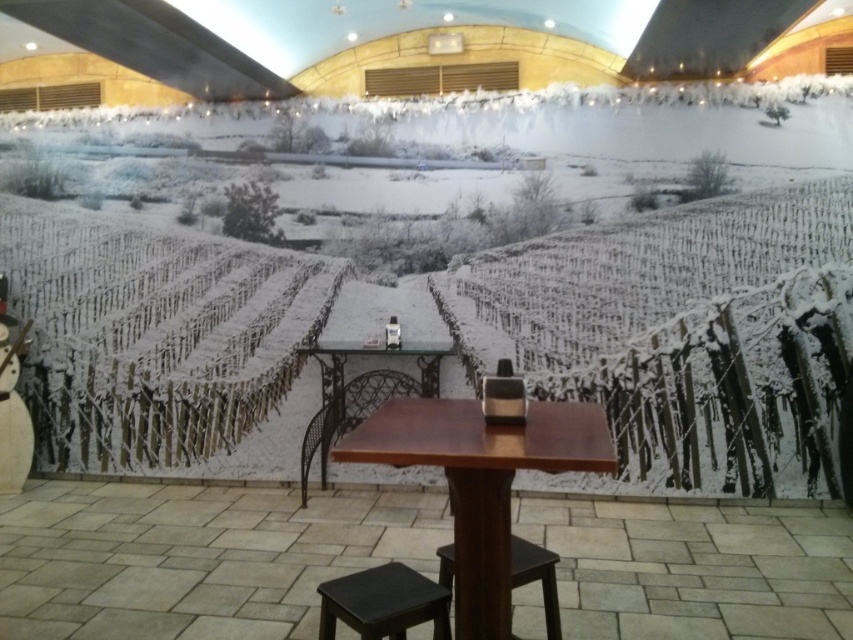
Which is behind, point (329, 611) or point (337, 433)?

The point (337, 433) is behind.

Does dark brown wooden stool at lower center appear under metallic brown chair at center?

Yes.

Where is `dark brown wooden stool at lower center`? This screenshot has width=853, height=640. dark brown wooden stool at lower center is located at coordinates (383, 602).

Where is `dark brown wooden stool at lower center`? Image resolution: width=853 pixels, height=640 pixels. dark brown wooden stool at lower center is located at coordinates [x=383, y=602].

Can you confirm if wooden table at center is wider than dark brown wooden stool at lower center?

Yes, wooden table at center is wider than dark brown wooden stool at lower center.

Does wooden table at center have a smaller size compared to dark brown wooden stool at lower center?

Actually, wooden table at center might be larger than dark brown wooden stool at lower center.

Locate an element on the screen. This screenshot has height=640, width=853. wooden table at center is located at coordinates (480, 481).

Can you confirm if wooden table at center is taller than dark brown wooden stool at center?

Indeed, wooden table at center has a greater height compared to dark brown wooden stool at center.

Who is higher up, wooden table at center or dark brown wooden stool at center?

wooden table at center is higher up.

Is point (459, 448) behind point (547, 566)?

No, (459, 448) is in front of (547, 566).

At what (x,y) coordinates should I click in order to perform the action: click on wooden table at center. Please return your answer as a coordinate pair (x, y). Looking at the image, I should click on (480, 481).